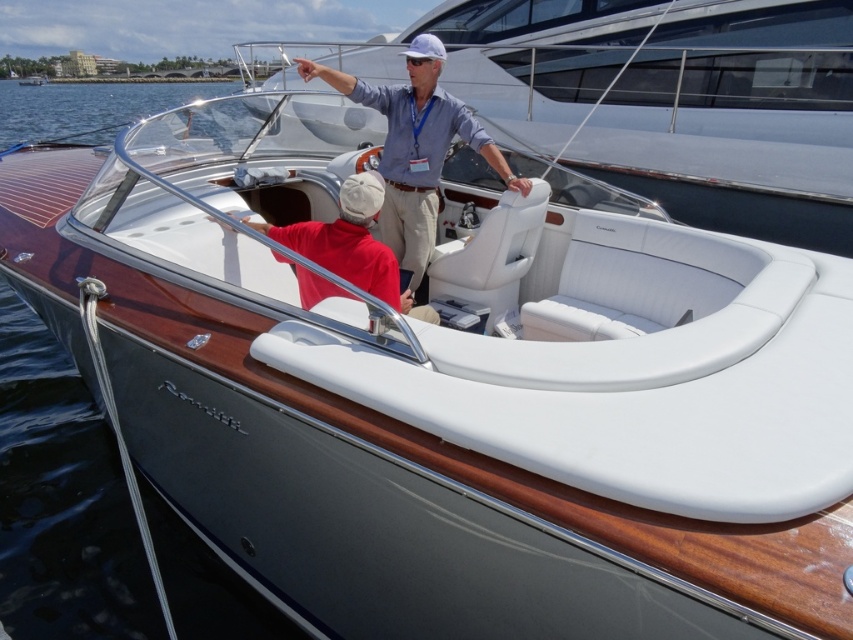
You are a passenger on the boat named Cantius. You notice the white leather boat at center and the matte blue shirt at center. Which object is positioned higher in the image?

The white leather boat at center is located above the matte blue shirt at center, so it is positioned higher in the image.

You are on the motorboat Cantius and need to determine the position of two points marked on the deck. Which point is closer to you, point (422,29) or point (358,86)?

Point (422,29) is further to the viewer than point (358,86), so point (358,86) is closer to you.